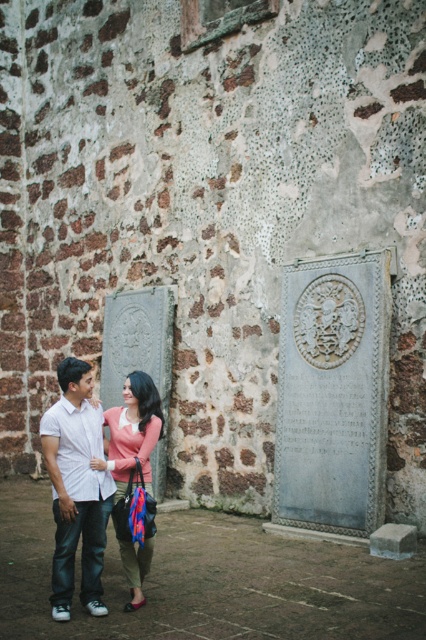
Question: Where is white cotton shirt at center located in relation to pink matte sweater at center in the image?

Choices:
 (A) below
 (B) above

Answer: (B)

Question: Which point appears farthest from the camera in this image?

Choices:
 (A) (100, 596)
 (B) (160, 412)

Answer: (B)

Question: Can you confirm if white cotton shirt at center is thinner than pink matte sweater at center?

Choices:
 (A) yes
 (B) no

Answer: (B)

Question: Among these objects, which one is farthest from the camera?

Choices:
 (A) white cotton shirt at center
 (B) pink matte sweater at center

Answer: (B)

Question: Is white cotton shirt at center smaller than pink matte sweater at center?

Choices:
 (A) yes
 (B) no

Answer: (B)